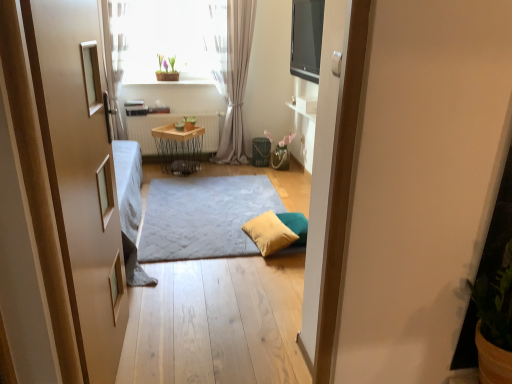
Where is `free spot above wooden radiator at center (from a real-world perspective)`? The image size is (512, 384). free spot above wooden radiator at center (from a real-world perspective) is located at coordinates (168, 111).